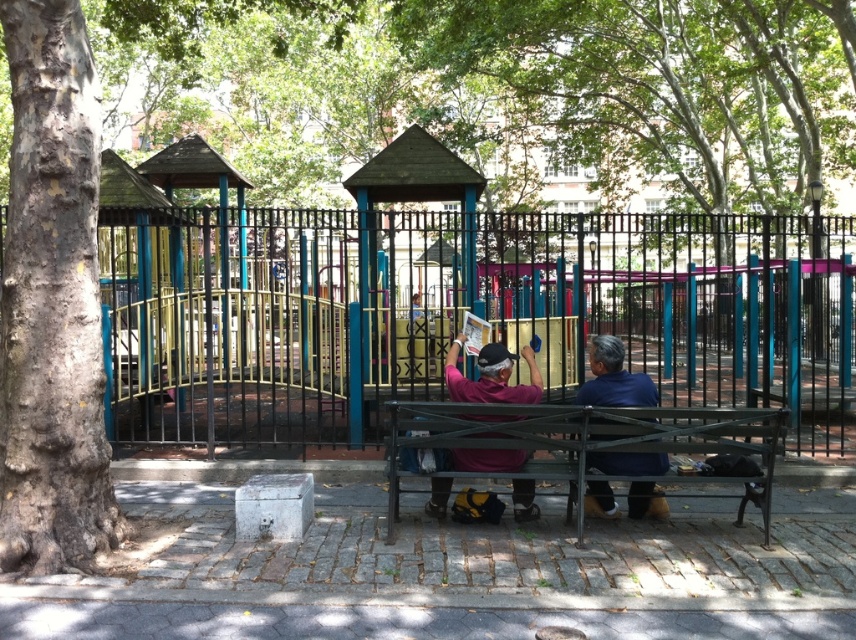
Question: Considering the real-world distances, which object is farthest from the metallic black fence at center?

Choices:
 (A) blue fabric shirt at center
 (B) rough bark tree at left
 (C) purple matte shirt at center
 (D) green leafy tree at center

Answer: (A)

Question: Can you confirm if metallic green bench at center is positioned to the left of blue fabric shirt at center?

Choices:
 (A) yes
 (B) no

Answer: (A)

Question: Where is metallic green bench at center located in relation to blue fabric shirt at center in the image?

Choices:
 (A) left
 (B) right

Answer: (A)

Question: Among these points, which one is nearest to the camera?

Choices:
 (A) (589, 356)
 (B) (589, 17)

Answer: (A)

Question: Is metallic green bench at center further to the viewer compared to purple matte shirt at center?

Choices:
 (A) no
 (B) yes

Answer: (A)

Question: Which point is farther from the camera taking this photo?

Choices:
 (A) (522, 516)
 (B) (587, 397)

Answer: (A)